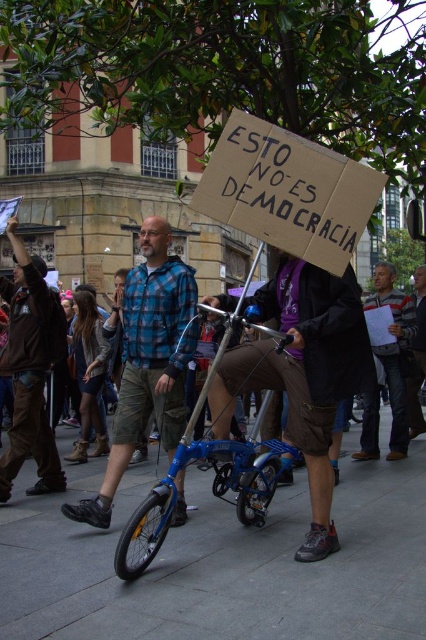
Question: Which of these objects is positioned farthest from the slate gray pavement at lower center?

Choices:
 (A) brown leather jacket at left
 (B) blue plaid shirt at center
 (C) dark gray jeans at center

Answer: (C)

Question: Is blue plaid shirt at center below brown leather jacket at left?

Choices:
 (A) yes
 (B) no

Answer: (A)

Question: Which object is the farthest from the brown leather jacket at left?

Choices:
 (A) blue plaid shirt at center
 (B) dark gray jeans at center
 (C) slate gray pavement at lower center

Answer: (B)

Question: Which object appears farthest from the camera in this image?

Choices:
 (A) blue plaid shirt at center
 (B) slate gray pavement at lower center
 (C) dark gray jeans at center

Answer: (C)

Question: Does slate gray pavement at lower center have a lesser width compared to dark gray jeans at center?

Choices:
 (A) no
 (B) yes

Answer: (A)

Question: Does slate gray pavement at lower center appear on the left side of dark gray jeans at center?

Choices:
 (A) no
 (B) yes

Answer: (B)